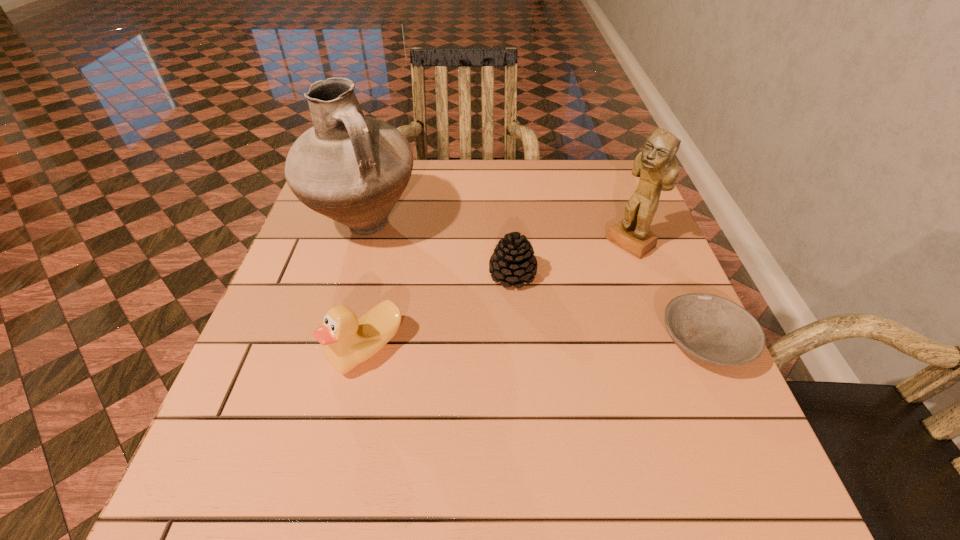
At what (x,y) coordinates should I click in order to perform the action: click on free spot on the desktop that is between the duck and the shortest object and is positioned on the handle side of the pitcher. Please return your answer as a coordinate pair (x, y). Looking at the image, I should click on (555, 346).

Find the location of a particular element. The image size is (960, 540). free space on the desktop that is between the duck and the shortest object and is positioned at the narrow end of the third object from left to right is located at coordinates (543, 346).

In order to click on vacant spot on the desktop that is between the duck and the shortest object and is positioned on the front-facing side of the figurine in this screenshot , I will do `click(502, 346)`.